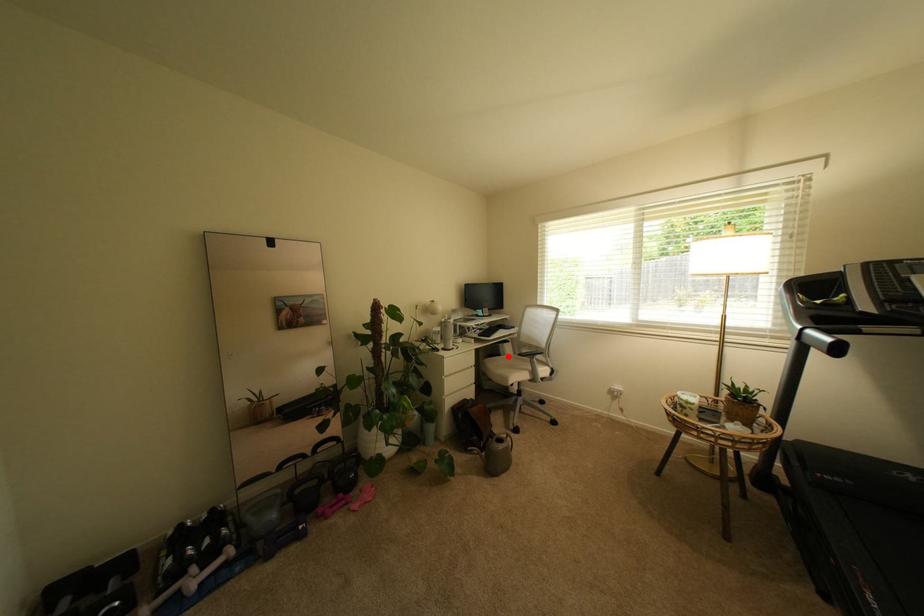
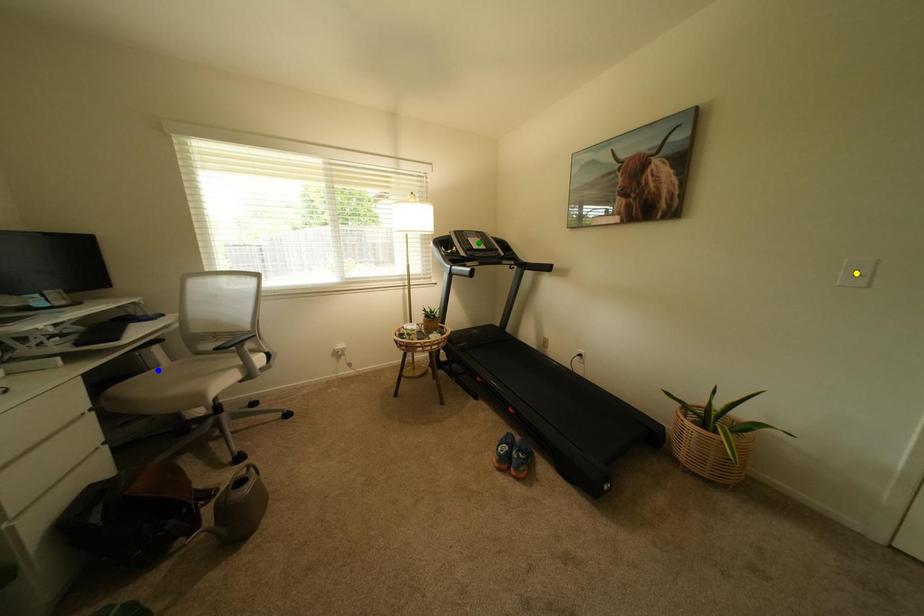
Question: I am providing you with two images of the same scene from different viewpoints. A red point is marked on the first image. You are given multiple points on the second image. Which point in image 2 represents the same 3d spot as the red point in image 1?

Choices:
 (A) yellow point
 (B) green point
 (C) blue point

Answer: (C)